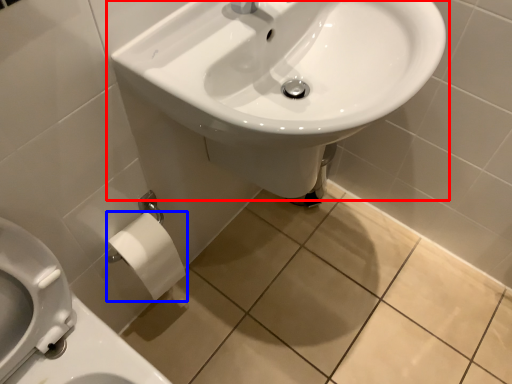
Question: Which object appears farthest to the camera in this image, sink (highlighted by a red box) or toilet paper (highlighted by a blue box)?

Choices:
 (A) sink
 (B) toilet paper

Answer: (B)